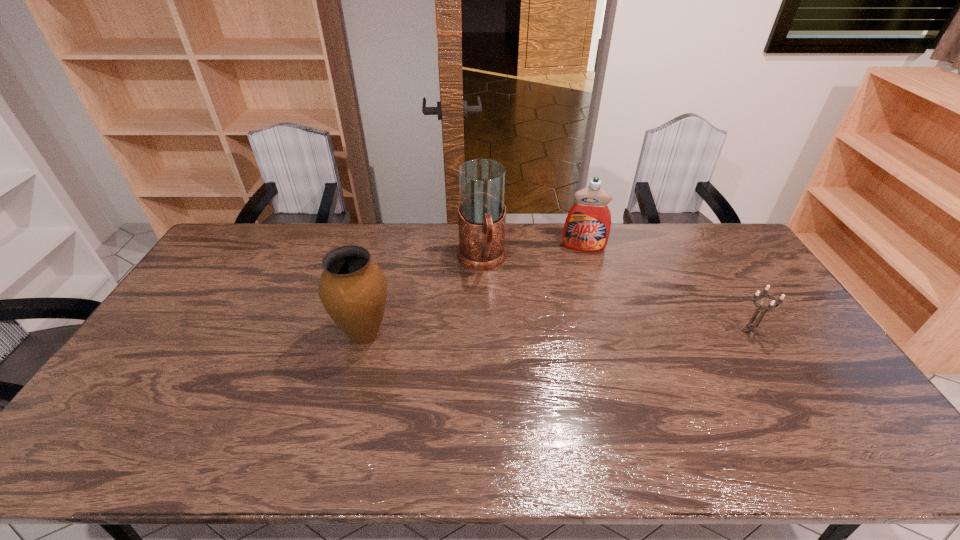
Identify the location of the leftmost object. Image resolution: width=960 pixels, height=540 pixels. (353, 289).

The width and height of the screenshot is (960, 540). I want to click on the rightmost object, so click(770, 308).

Locate an element on the screen. candle holder is located at coordinates (770, 308).

I want to click on the tallest object, so click(x=482, y=213).

The image size is (960, 540). In order to click on the third object from right to left in this screenshot , I will do `click(482, 213)`.

At what (x,y) coordinates should I click in order to perform the action: click on the second object from right to left. Please return your answer as a coordinate pair (x, y). The width and height of the screenshot is (960, 540). Looking at the image, I should click on (587, 227).

The height and width of the screenshot is (540, 960). In order to click on free location located on the back of the leftmost object in this screenshot , I will do `click(378, 280)`.

Find the location of a particular element. This screenshot has height=540, width=960. free location located on the left of the rightmost object is located at coordinates (x=652, y=332).

Identify the location of blank space located with the handle on the side of the third object from right to left. The height and width of the screenshot is (540, 960). (507, 360).

Image resolution: width=960 pixels, height=540 pixels. What are the coordinates of `free space located 0.330m with the handle on the side of the third object from right to left` in the screenshot? It's located at (507, 360).